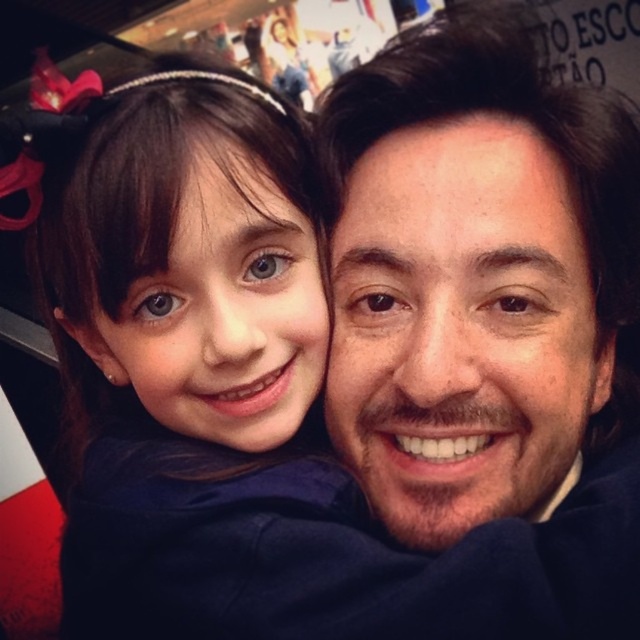
Can you confirm if matte blue dress at center is wider than matte plastic photo frame at upper center?

Indeed, matte blue dress at center has a greater width compared to matte plastic photo frame at upper center.

Does matte blue dress at center have a lesser height compared to matte plastic photo frame at upper center?

In fact, matte blue dress at center may be taller than matte plastic photo frame at upper center.

The height and width of the screenshot is (640, 640). I want to click on matte blue dress at center, so [186, 285].